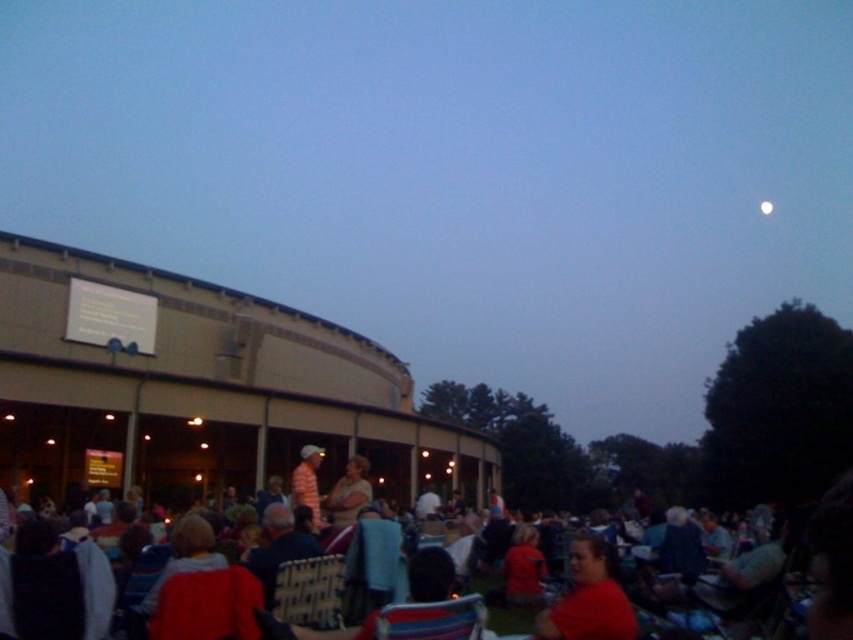
Who is more distant from viewer, (335, 506) or (297, 472)?

The point (297, 472) is more distant.

Which is in front, point (352, 474) or point (315, 499)?

Positioned in front is point (352, 474).

The width and height of the screenshot is (853, 640). Identify the location of matte beige sweater at center. (x=347, y=493).

Looking at this image, which is below, matte red shirt at center or striped cotton shirt at center?

matte red shirt at center

Between matte red shirt at center and striped cotton shirt at center, which one appears on the right side from the viewer's perspective?

matte red shirt at center is more to the right.

Who is more forward, [602,609] or [305,460]?

Positioned in front is point [602,609].

The height and width of the screenshot is (640, 853). In order to click on matte red shirt at center in this screenshot , I will do `click(589, 598)`.

Does matte red shirt at center have a smaller size compared to white glossy moon at upper right?

No, matte red shirt at center is not smaller than white glossy moon at upper right.

Who is taller, matte red shirt at center or white glossy moon at upper right?

With more height is matte red shirt at center.

This screenshot has height=640, width=853. I want to click on matte red shirt at center, so click(589, 598).